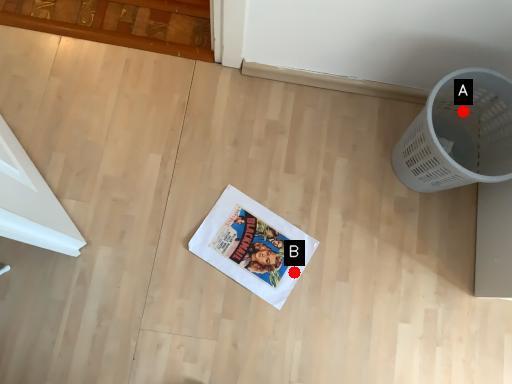
Question: Two points are circled on the image, labeled by A and B beside each circle. Among these points, which one is nearest to the camera?

Choices:
 (A) A is closer
 (B) B is closer

Answer: (B)